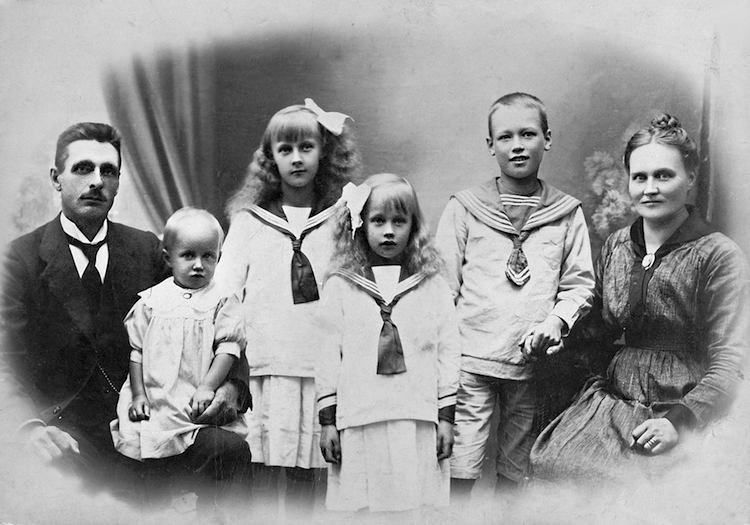
Where is `curtain`? The image size is (750, 525). curtain is located at coordinates (157, 175).